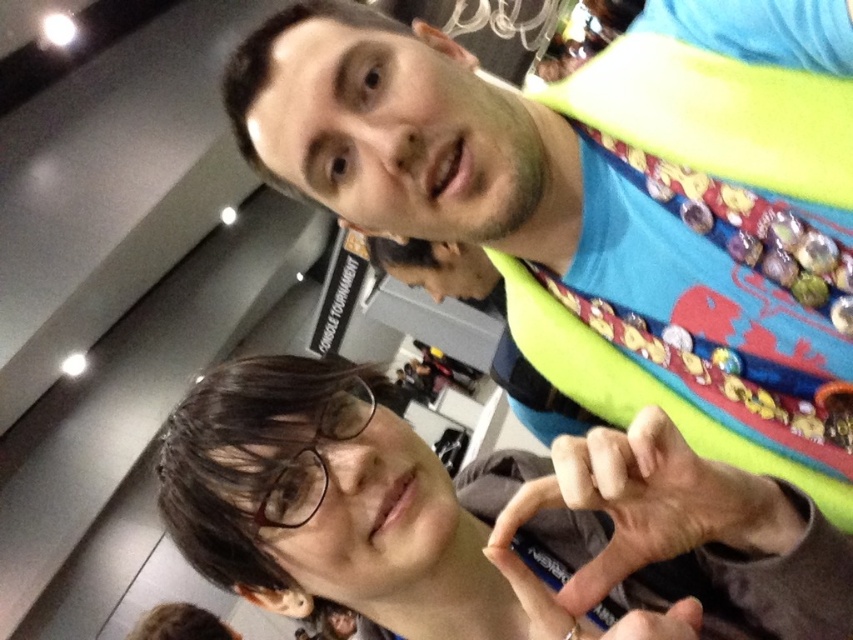
You are organizing a convention and need to ensure that the matte blue shirt at upper center and the matte black pen at center can fit side by side on a display stand. The stand can only accommodate items up to the width of the wider object. Which object determines the minimum required width for the stand?

The matte blue shirt at upper center determines the minimum required width for the stand because its width surpasses that of the matte black pen at center.

You are a photographer at the event and want to capture a photo where the matte blue shirt at upper center and the brown matte glasses at lower left are both clearly visible. Based on their positions, which object should you focus on first to ensure both are in frame?

The matte blue shirt at upper center is above the brown matte glasses at lower left, so focusing on the matte blue shirt at upper center first will ensure both are in frame as the glasses are positioned lower.

You are a photographer setting up for an event. You need to adjust the camera focus so that both the matte blue shirt at upper center and the brown matte glasses at lower left are clearly visible. Given their positions, which object should you focus on first to ensure both are in focus?

The matte blue shirt at upper center is taller than the brown matte glasses at lower left. To ensure both are in focus, you should focus on the matte blue shirt at upper center first, as it is larger in the frame and adjusting focus starting from the taller object can help capture both effectively.